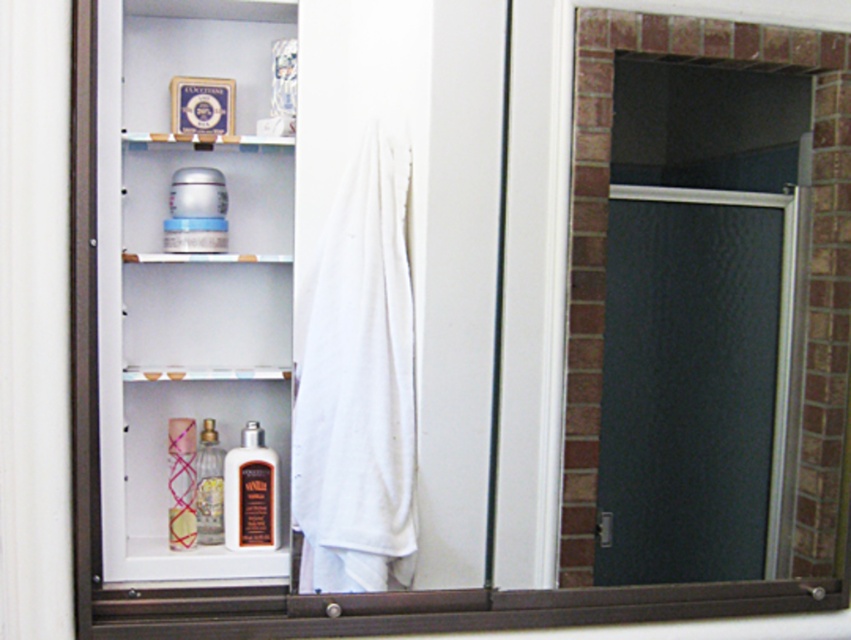
You are organizing the bathroom shelves and want to place the brown matte lotion at center and the translucent glass perfume bottle at center on the same shelf. Which one should you place on the left to maintain proper alignment?

You should place the translucent glass perfume bottle at center on the left side since the brown matte lotion at center is positioned to its right.

Based on the photo, you are organizing the bathroom shelves and want to place the white cotton robe at center and the translucent glass bottles at center on the same shelf. Which item should you place first to ensure they both fit?

The white cotton robe at center is smaller than the translucent glass bottles at center, so you should place the translucent glass bottles at center first to accommodate their larger size, then the white cotton robe at center.

You are organizing items in a bathroom and need to place a new item that requires more vertical space. Which object between the white cotton robe at center and the translucent glass bottles at center should you place it next to, considering their height?

The white cotton robe at center is taller than the translucent glass bottles at center, so you should place the new item next to the white cotton robe at center to accommodate its height requirement.